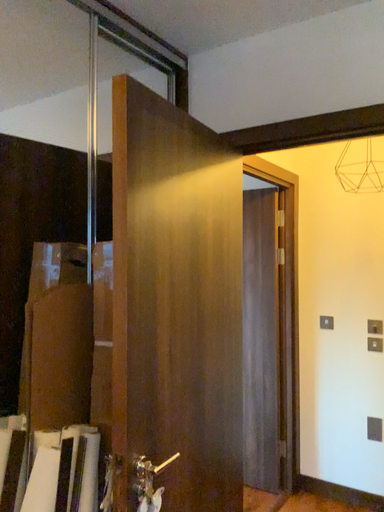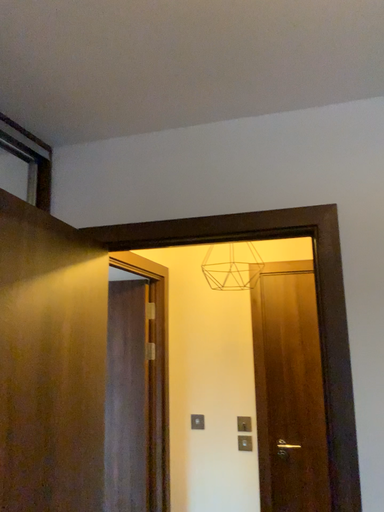
Question: How did the camera likely rotate when shooting the video?

Choices:
 (A) rotated downward
 (B) rotated upward

Answer: (B)